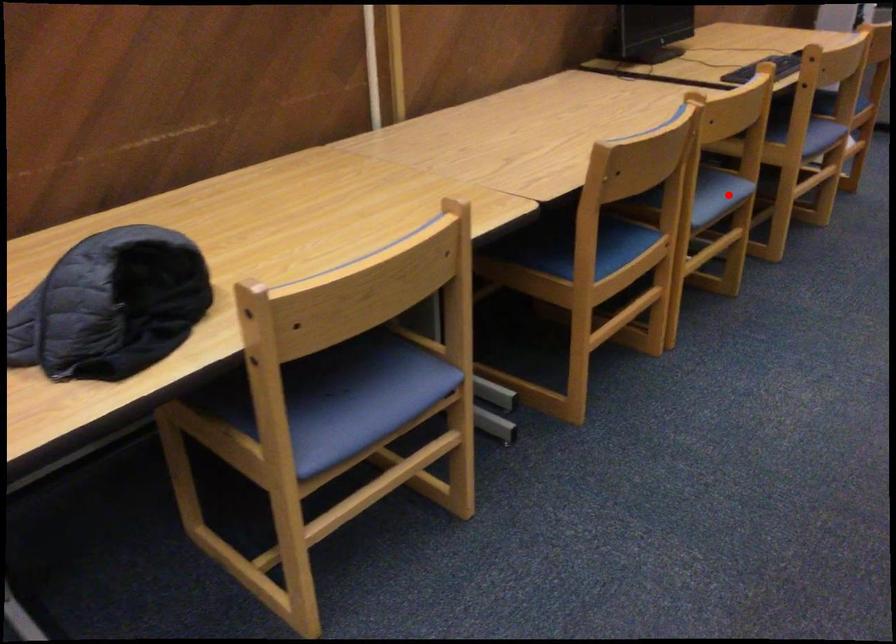
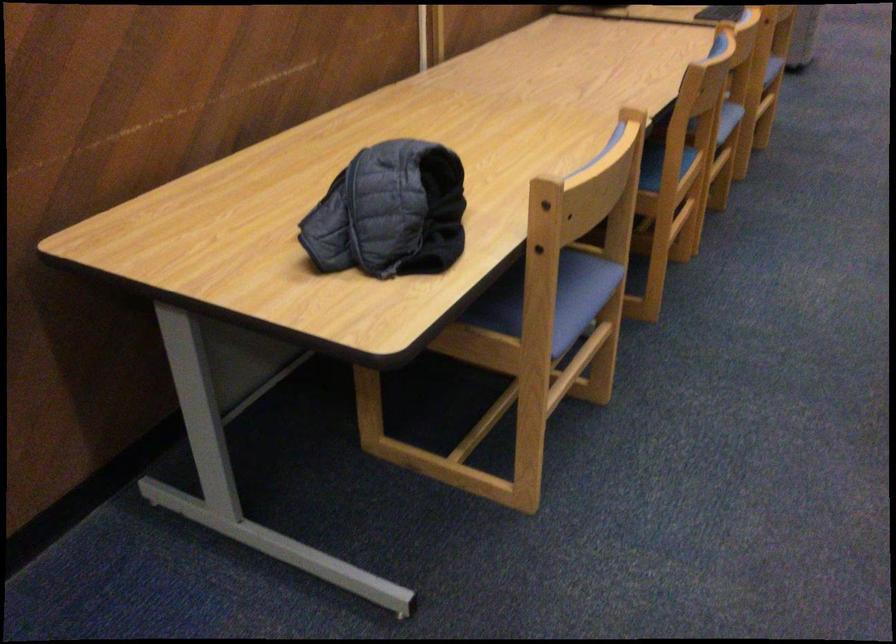
Question: A red point is marked in image1. In image2, is the corresponding 3D point closer to the camera or farther? Reply with the corresponding letter.

Choices:
 (A) The corresponding 3D point is closer.
 (B) The corresponding 3D point is farther.

Answer: (B)